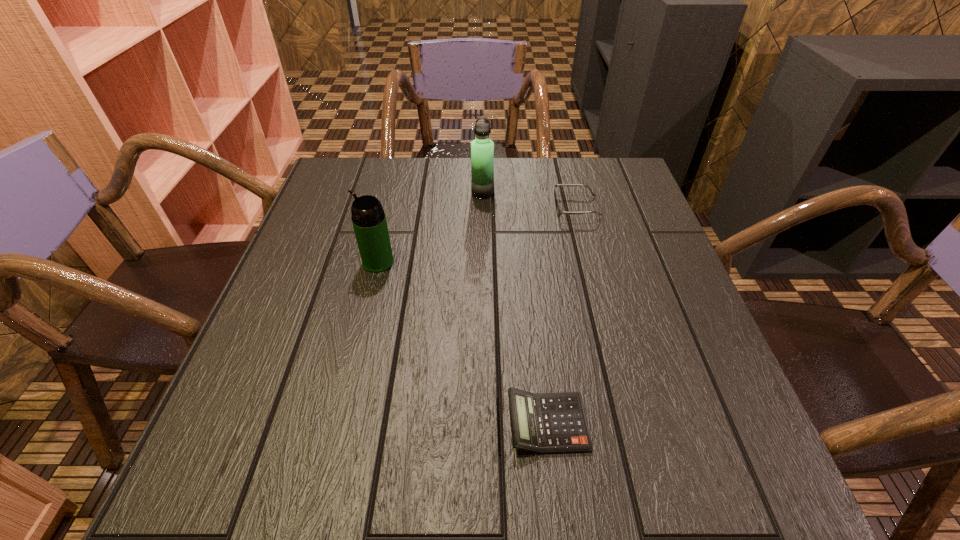
The height and width of the screenshot is (540, 960). What are the coordinates of `free space between the calculator and the right thermos bottle` in the screenshot? It's located at (515, 308).

The image size is (960, 540). In order to click on free space between the leftmost object and the calculator in this screenshot , I will do `click(463, 342)`.

Find the location of a particular element. The width and height of the screenshot is (960, 540). vacant area that lies between the third object from right to left and the left thermos bottle is located at coordinates (430, 227).

What are the coordinates of `vacant area that lies between the leftmost object and the rightmost object` in the screenshot? It's located at (477, 234).

Locate an element on the screen. vacant area that lies between the farther thermos bottle and the sunglasses is located at coordinates (530, 200).

Identify which object is the nearest to the sunglasses. Please provide its 2D coordinates. Your answer should be formatted as a tuple, i.e. [(x, y)], where the tuple contains the x and y coordinates of a point satisfying the conditions above.

[(482, 148)]

Identify which object is the second nearest to the rightmost object. Please provide its 2D coordinates. Your answer should be formatted as a tuple, i.e. [(x, y)], where the tuple contains the x and y coordinates of a point satisfying the conditions above.

[(369, 222)]

The width and height of the screenshot is (960, 540). Identify the location of free location that satisfies the following two spatial constraints: 1. from the spout of the left thermos bottle; 2. on the left side of the nearest object. (340, 423).

Where is `vacant space that satisfies the following two spatial constraints: 1. on the front side of the right thermos bottle; 2. from the spout of the second nearest object`? Image resolution: width=960 pixels, height=540 pixels. vacant space that satisfies the following two spatial constraints: 1. on the front side of the right thermos bottle; 2. from the spout of the second nearest object is located at coordinates (483, 262).

Where is `vacant area that satisfies the following two spatial constraints: 1. on the front side of the nearest object; 2. on the left side of the farther thermos bottle`? Image resolution: width=960 pixels, height=540 pixels. vacant area that satisfies the following two spatial constraints: 1. on the front side of the nearest object; 2. on the left side of the farther thermos bottle is located at coordinates (484, 423).